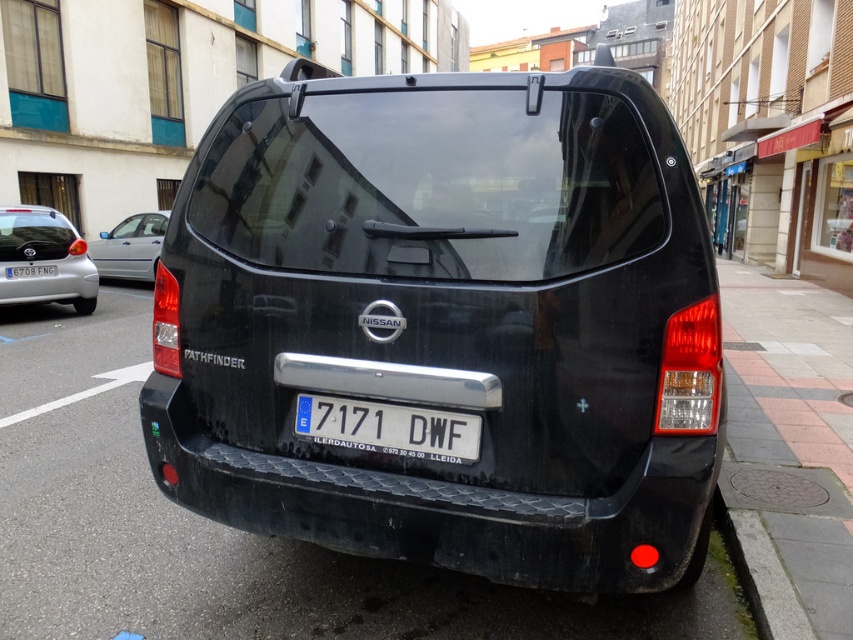
You are standing behind the black Nissan Pathfinder and want to walk to the curb. Which point, point [622,582] or point [352,400], is closer to the curb?

Point [622,582] is in front of point [352,400], so it is closer to the curb.

You are a delivery person trying to park your van behind the black Nissan Pathfinder. The van requires a space where the bumper is larger than the curb. Can you park behind the rubber textured bumper at center without hitting the gray concrete curb at lower right?

The rubber textured bumper at center is bigger than the gray concrete curb at lower right, so yes, you can park behind the rubber textured bumper at center without hitting the gray concrete curb at lower right since the bumper is larger in size.

You are a parking inspector checking if vehicles are properly aligned. The rule states that the vehicle must be positioned so that its bumper is not extending beyond the curb. Based on the image, is the rubber textured bumper at center positioned correctly relative to the gray concrete curb at lower right?

The rubber textured bumper at center is to the left of the gray concrete curb at lower right, so it is positioned correctly as it does not extend beyond the curb.